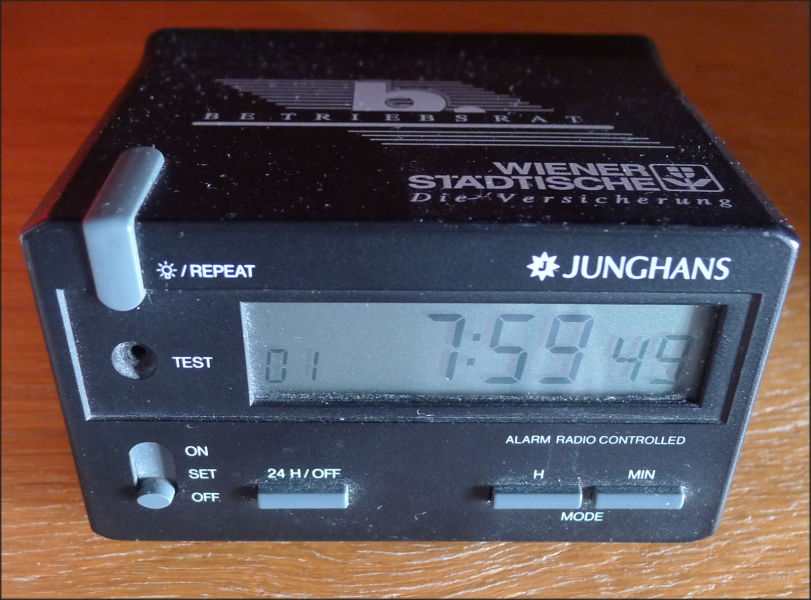
Locate an element on the screen. The height and width of the screenshot is (600, 811). on/off switch is located at coordinates (157, 483).